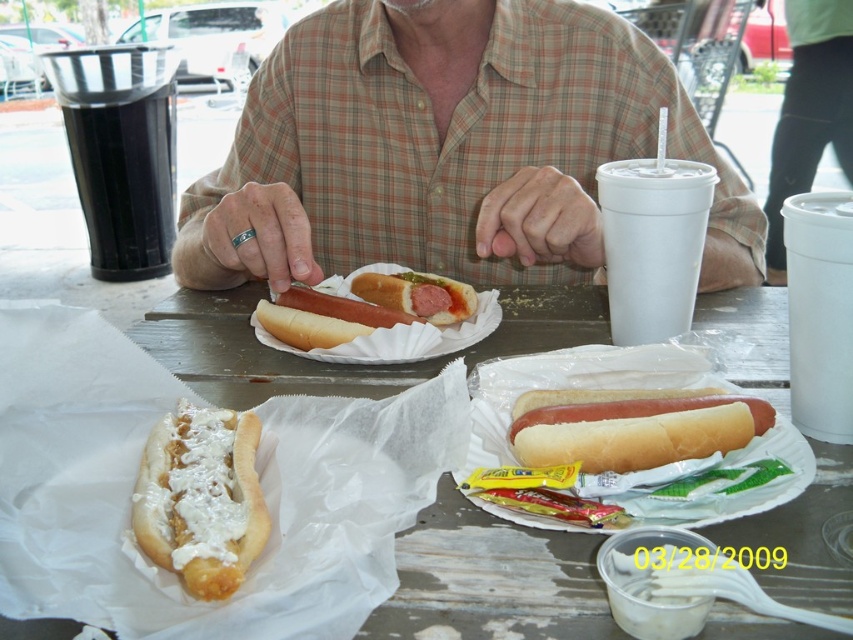
What is located at the coordinates point (447, 148) in the image?

A plaid shirt is located at point (447, 148).

You are standing at the picnic table and want to grab the closest item to you. Which point should you reach towards, point [653,426] or point [323,332]?

Point [653,426] is closer to the viewer, so you should reach towards point [653,426].

You are at a picnic table and want to grab the smooth red hot dog at center. Which direction should you look first to find it relative to the white paper hot dog at center?

The smooth red hot dog at center is above the white paper hot dog at center, so you should look upwards from the white paper hot dog at center to find it.